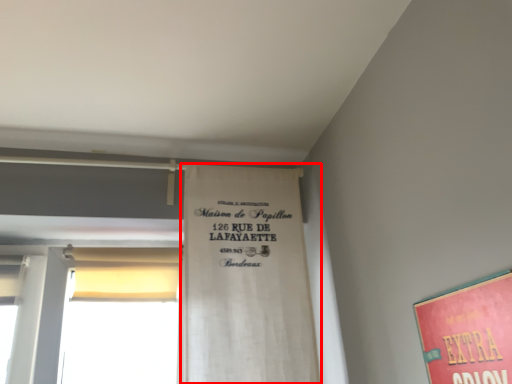
Question: From the image's perspective, considering the relative positions of bulletin board (annotated by the red box) and poster in the image provided, where is bulletin board (annotated by the red box) located with respect to the staircase?

Choices:
 (A) above
 (B) below

Answer: (A)